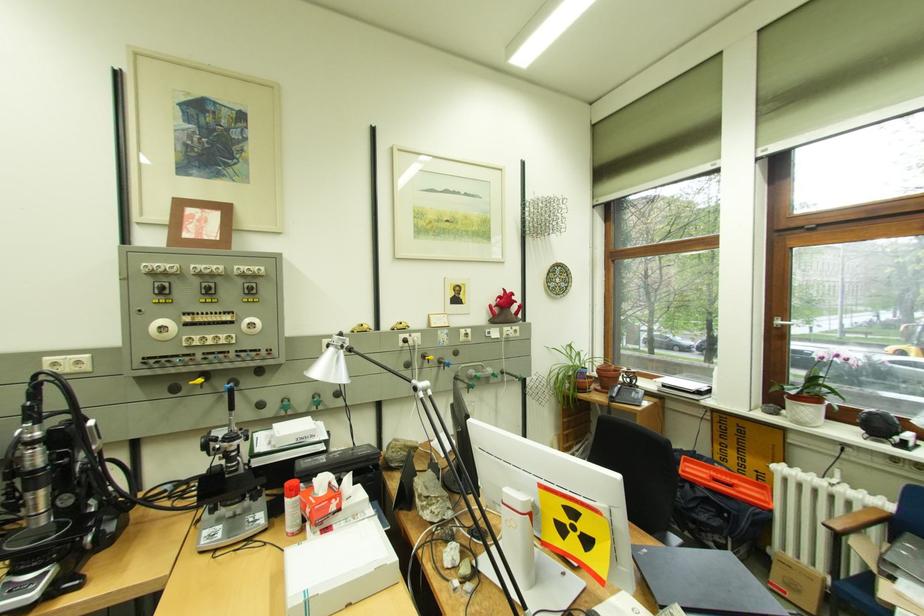
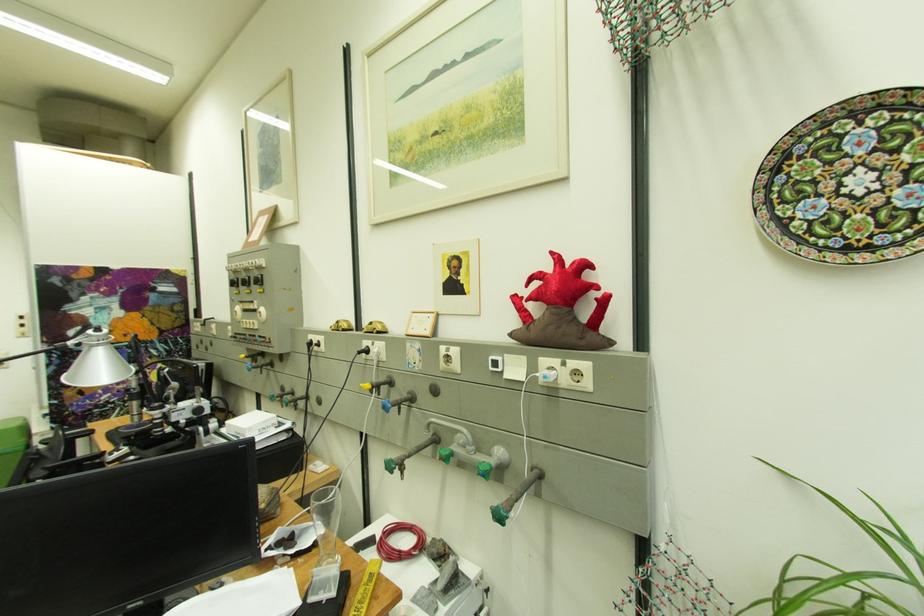
Find the pixel in the second image that matches (x=412, y=337) in the first image.

(375, 344)